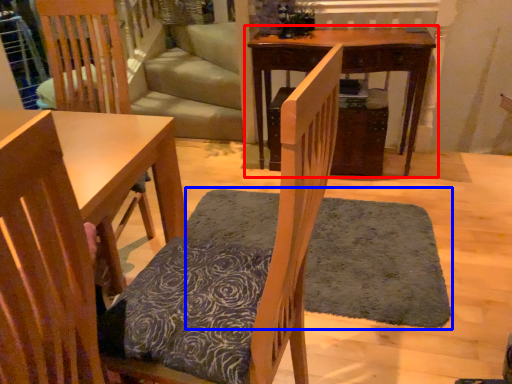
Question: Which point is further to the camera, table (highlighted by a red box) or doormat (highlighted by a blue box)?

Choices:
 (A) table
 (B) doormat

Answer: (A)